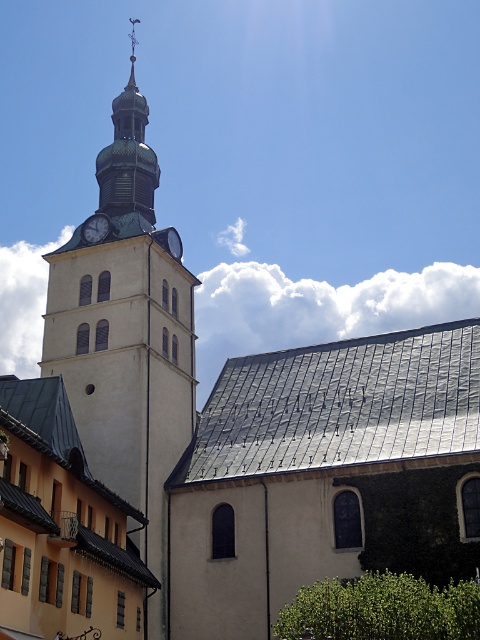
Can you confirm if matte gray clock at upper left is bigger than metallic silver clock at upper center?

Yes, matte gray clock at upper left is bigger than metallic silver clock at upper center.

Which is behind, point (96, 214) or point (175, 236)?

Point (175, 236)

Locate an element on the screen. matte gray clock at upper left is located at coordinates (95, 228).

Can you confirm if green wood spire at upper center is bigger than matte gray clock at upper left?

Correct, green wood spire at upper center is larger in size than matte gray clock at upper left.

Is green wood spire at upper center positioned at the back of matte gray clock at upper left?

Yes, green wood spire at upper center is behind matte gray clock at upper left.

Which is in front, point (116, 112) or point (91, 216)?

Point (91, 216) is more forward.

At what (x,y) coordinates should I click in order to perform the action: click on green wood spire at upper center. Please return your answer as a coordinate pair (x, y). Looking at the image, I should click on (128, 156).

Is green wood spire at upper center below metallic silver clock at upper center?

Actually, green wood spire at upper center is above metallic silver clock at upper center.

Between point (99, 160) and point (160, 237), which one is positioned behind?

Point (99, 160)

This screenshot has width=480, height=640. I want to click on green wood spire at upper center, so click(x=128, y=156).